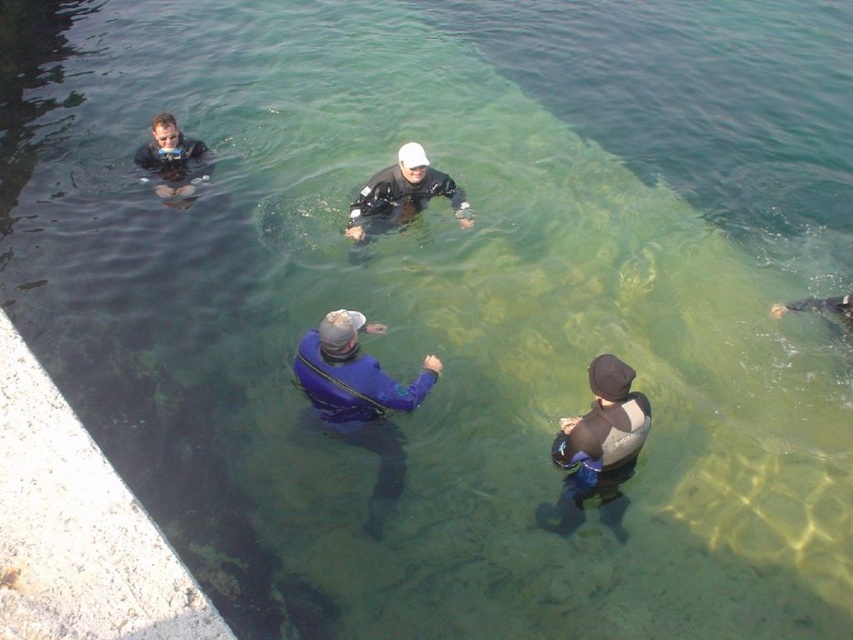
From the picture: You are a lifeguard on duty and need to ensure all divers are properly equipped. You notice two divers wearing the gray neoprene wetsuit at lower center and the matte black wetsuit at center. Based on their wetsuit sizes, which diver might need a size adjustment?

The gray neoprene wetsuit at lower center is much taller than the matte black wetsuit at center, so the diver wearing the gray neoprene wetsuit at lower center might need a size adjustment as it appears too long for their body.

You are a diver preparing to enter the water. You see the blue neoprene wetsuit at center and the matte black wetsuit at upper left. Which wetsuit is closer to you?

The blue neoprene wetsuit at center is closer to you because it is in front of the matte black wetsuit at upper left.